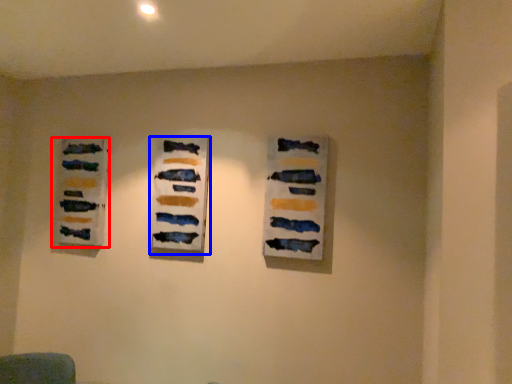
Question: Which of the following is the farthest to the observer, art exhibition (highlighted by a red box) or art exhibition (highlighted by a blue box)?

Choices:
 (A) art exhibition
 (B) art exhibition

Answer: (A)